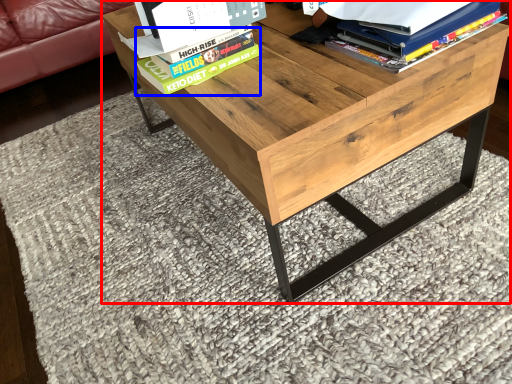
Question: Which point is closer to the camera, table (highlighted by a red box) or paperback book (highlighted by a blue box)?

Choices:
 (A) table
 (B) paperback book

Answer: (A)